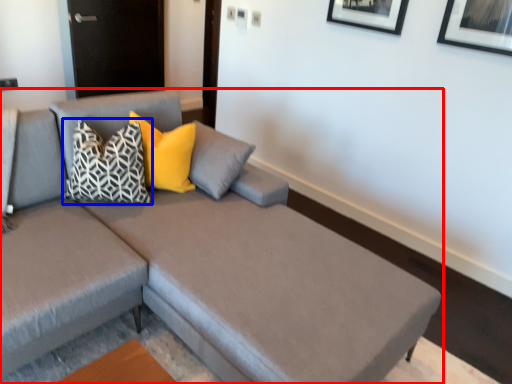
Question: Among these objects, which one is farthest to the camera, studio couch (highlighted by a red box) or pillow (highlighted by a blue box)?

Choices:
 (A) studio couch
 (B) pillow

Answer: (B)